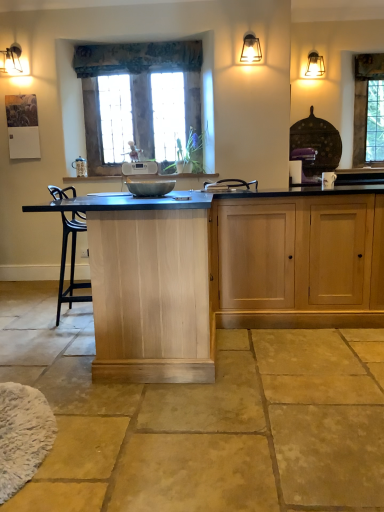
I want to click on free space in front of light wood cabinet at center, so click(306, 347).